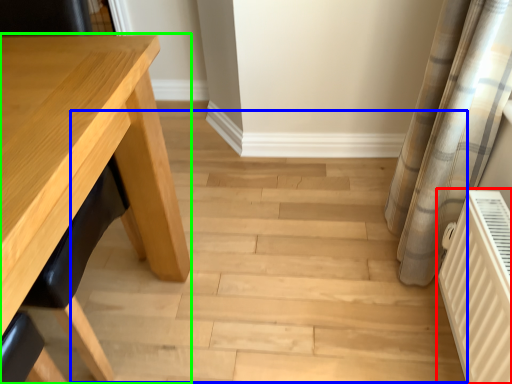
Question: Which object is positioned closest to radiator (highlighted by a red box)? Select from stair (highlighted by a blue box) and table (highlighted by a green box).

Choices:
 (A) stair
 (B) table

Answer: (A)